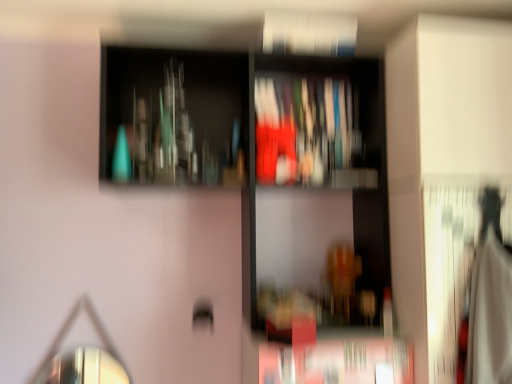
Where is `free space behind white paper book at upper center, the 1th book positioned from the top`? This screenshot has width=512, height=384. free space behind white paper book at upper center, the 1th book positioned from the top is located at coordinates (313, 61).